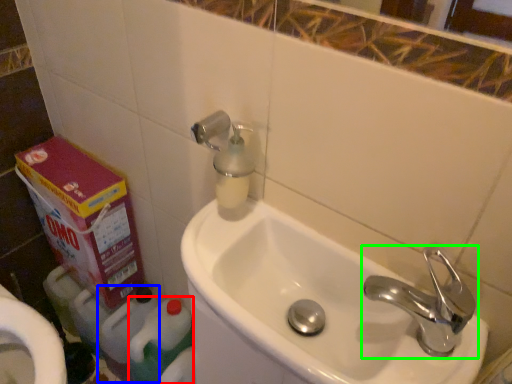
Question: Which object is the farthest from cleaning product (highlighted by a red box)? Choose among these: cleaning product (highlighted by a blue box) or tap (highlighted by a green box).

Choices:
 (A) cleaning product
 (B) tap

Answer: (B)